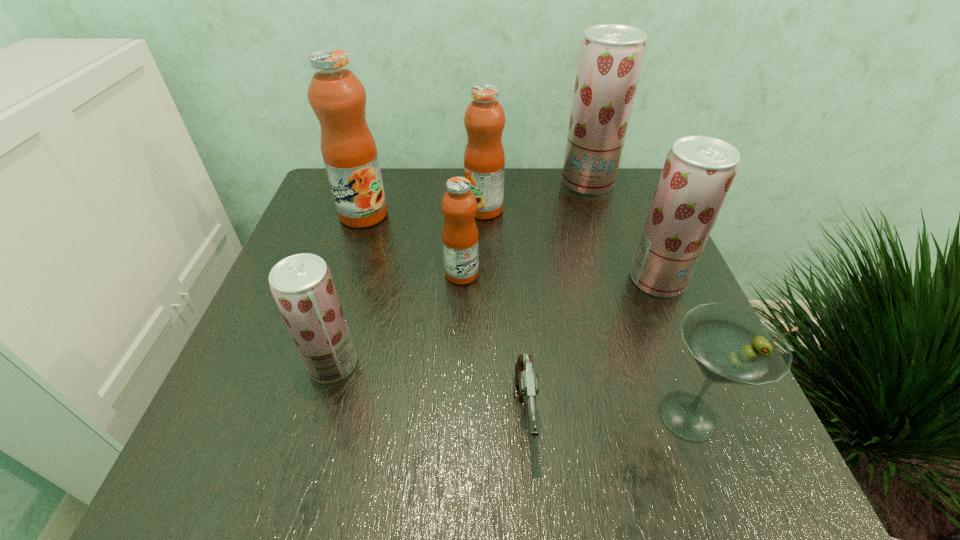
Find the location of a particular element. This screenshot has height=540, width=960. free location that satisfies the following two spatial constraints: 1. on the front label of the martini; 2. on the right side of the nearest orange fruit juice is located at coordinates (456, 416).

This screenshot has height=540, width=960. Find the location of `vacant region that satisfies the following two spatial constraints: 1. on the back side of the second smallest strawberry fruit juice; 2. on the front label of the second smallest orange fruit juice`. vacant region that satisfies the following two spatial constraints: 1. on the back side of the second smallest strawberry fruit juice; 2. on the front label of the second smallest orange fruit juice is located at coordinates (628, 210).

The width and height of the screenshot is (960, 540). I want to click on free spot that satisfies the following two spatial constraints: 1. on the front label of the nearest orange fruit juice; 2. on the left side of the martini, so click(x=456, y=416).

Where is `vacant area that satisfies the following two spatial constraints: 1. on the front label of the second smallest orange fruit juice; 2. on the right side of the second nearest strawberry fruit juice`? vacant area that satisfies the following two spatial constraints: 1. on the front label of the second smallest orange fruit juice; 2. on the right side of the second nearest strawberry fruit juice is located at coordinates (485, 280).